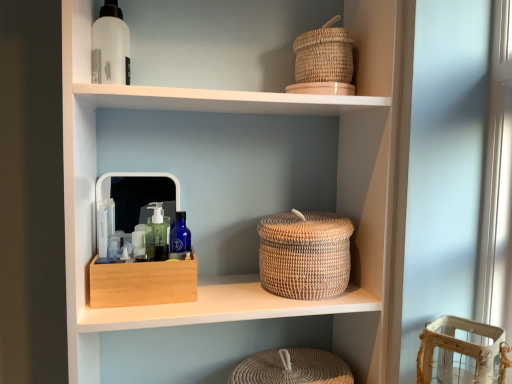
Question: Could you tell me if woven natural basket at upper right, which ranks as the 3th basket in bottom-to-top order, is facing natural woven basket at center?

Choices:
 (A) yes
 (B) no

Answer: (A)

Question: Is woven natural basket at upper right, which ranks as the 3th basket in bottom-to-top order, far from natural woven basket at center?

Choices:
 (A) no
 (B) yes

Answer: (A)

Question: From a real-world perspective, is woven natural basket at upper right, marked as the 1th basket in a top-to-bottom arrangement, physically above natural woven basket at center?

Choices:
 (A) yes
 (B) no

Answer: (A)

Question: Does woven natural basket at upper right, which ranks as the 3th basket in bottom-to-top order, appear on the right side of natural woven basket at center?

Choices:
 (A) no
 (B) yes

Answer: (B)

Question: Is woven natural basket at upper right, which ranks as the 3th basket in bottom-to-top order, facing away from natural woven basket at center?

Choices:
 (A) no
 (B) yes

Answer: (B)

Question: Can you confirm if woven natural basket at upper right, which ranks as the 3th basket in bottom-to-top order, is smaller than natural woven basket at center?

Choices:
 (A) yes
 (B) no

Answer: (A)

Question: Is natural woven basket at center completely or partially inside woven beige basket at center, which is the 2th basket in bottom-to-top order?

Choices:
 (A) no
 (B) yes

Answer: (A)

Question: From a real-world perspective, is woven beige basket at center, which is the 2th basket in bottom-to-top order, physically below natural woven basket at center?

Choices:
 (A) yes
 (B) no

Answer: (A)

Question: Is the position of woven beige basket at center, which is the 2th basket in bottom-to-top order, less distant than that of natural woven basket at center?

Choices:
 (A) no
 (B) yes

Answer: (A)

Question: Is natural woven basket at center at the back of woven beige basket at center, which is the 2th basket in bottom-to-top order?

Choices:
 (A) no
 (B) yes

Answer: (B)

Question: Are woven beige basket at center, the 2th basket viewed from the top, and natural woven basket at center making contact?

Choices:
 (A) yes
 (B) no

Answer: (B)

Question: Does woven beige basket at center, the 2th basket viewed from the top, have a greater height compared to natural woven basket at center?

Choices:
 (A) yes
 (B) no

Answer: (B)

Question: From the image's perspective, is woven beige basket at lower right, the 3th basket viewed from the top, under natural woven basket at center?

Choices:
 (A) no
 (B) yes

Answer: (B)